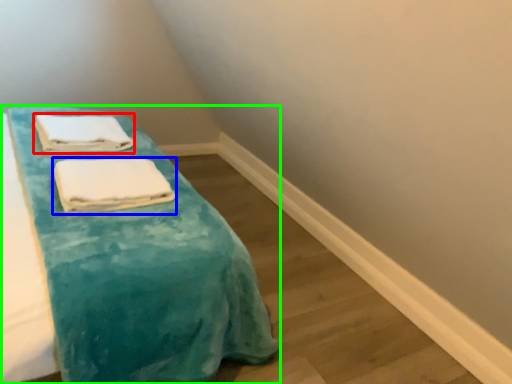
Question: Which is farther away from towel (highlighted by a red box)? towel (highlighted by a blue box) or furniture (highlighted by a green box)?

Choices:
 (A) towel
 (B) furniture

Answer: (B)